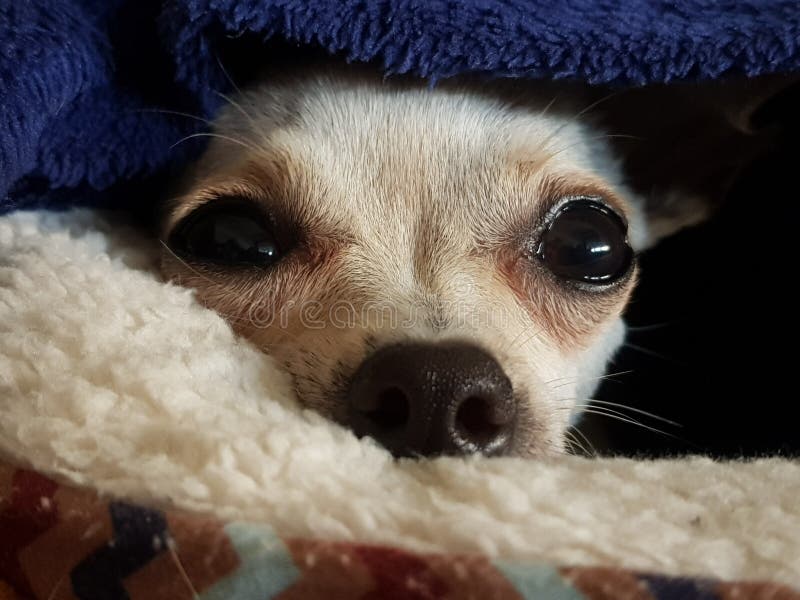
Find the location of a particular element. The height and width of the screenshot is (600, 800). fleece inside of dog bed is located at coordinates (313, 467).